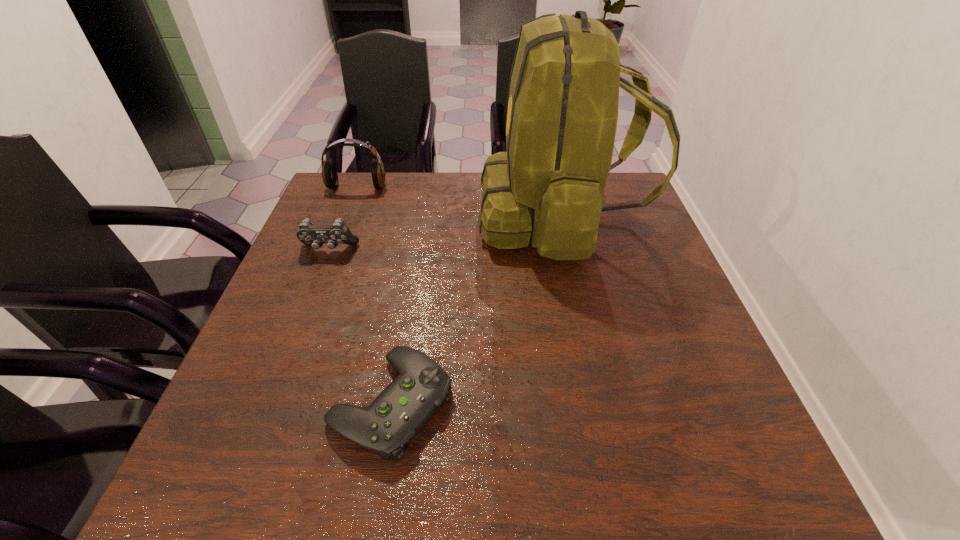
Where is `free space that satisfies the following two spatial constraints: 1. on the front-facing side of the backpack; 2. on the surface of the farther control with buttons`? The width and height of the screenshot is (960, 540). free space that satisfies the following two spatial constraints: 1. on the front-facing side of the backpack; 2. on the surface of the farther control with buttons is located at coordinates (568, 249).

You are a GUI agent. You are given a task and a screenshot of the screen. Output one action in this format:
    pyautogui.click(x=<x>, y=<y>)
    Task: Click on the vacant space that satisfies the following two spatial constraints: 1. on the ear cups of the headset; 2. on the right side of the shorter control
    The width and height of the screenshot is (960, 540).
    Given the screenshot: What is the action you would take?
    pyautogui.click(x=275, y=403)

Locate an element on the screen. free location that satisfies the following two spatial constraints: 1. on the ear cups of the headset; 2. on the right side of the right control is located at coordinates (275, 403).